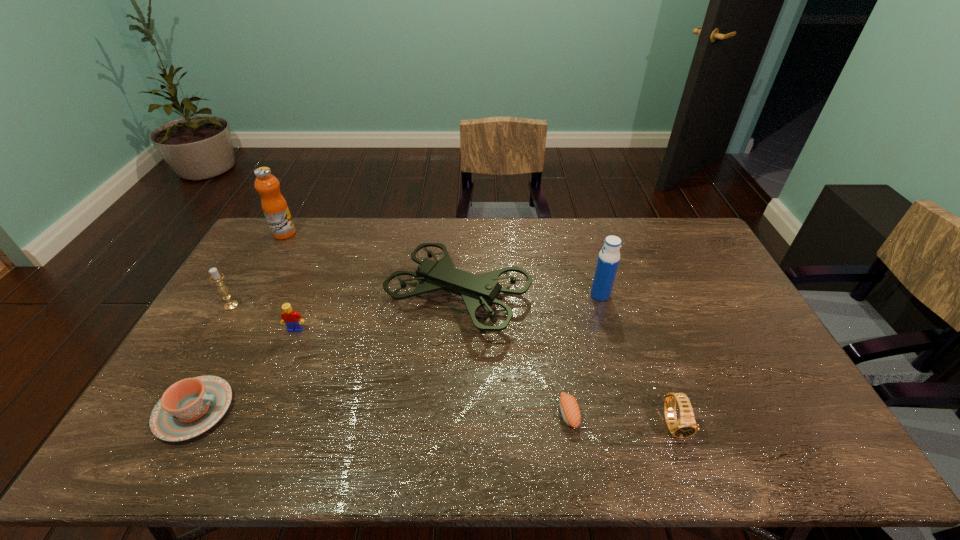
You are a GUI agent. You are given a task and a screenshot of the screen. Output one action in this format:
    pyautogui.click(x=<x>, y=<y>)
    Task: Click on the farthest object
    The image size is (960, 540).
    Given the screenshot: What is the action you would take?
    pyautogui.click(x=275, y=208)

At what (x,y) coordinates should I click in order to perform the action: click on the tallest object. Please return your answer as a coordinate pair (x, y). Image resolution: width=960 pixels, height=540 pixels. Looking at the image, I should click on click(x=275, y=208).

At what (x,y) coordinates should I click in order to perform the action: click on water bottle. Please return your answer as a coordinate pair (x, y). The width and height of the screenshot is (960, 540). Looking at the image, I should click on click(x=608, y=260).

Where is `drone`? This screenshot has width=960, height=540. drone is located at coordinates (479, 290).

I want to click on candle holder, so click(x=216, y=277).

Identify the location of the fifth object from right to left. (293, 320).

The image size is (960, 540). Identify the location of watch. (686, 426).

You are a GUI agent. You are given a task and a screenshot of the screen. Output one action in this format:
    pyautogui.click(x=<x>, y=<y>)
    Task: Click on the seventh tallest object
    This screenshot has width=960, height=540.
    Given the screenshot: What is the action you would take?
    pyautogui.click(x=188, y=408)

I want to click on the shortest object, so click(x=569, y=408).

Locate an element on the screen. The image size is (960, 540). sushi is located at coordinates (569, 408).